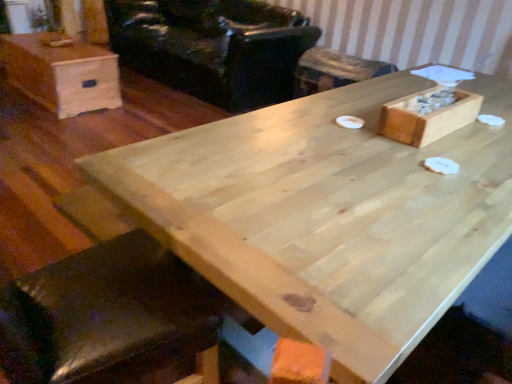
The height and width of the screenshot is (384, 512). I want to click on vacant area on top of natural wood table at center (from a real-world perspective), so click(356, 155).